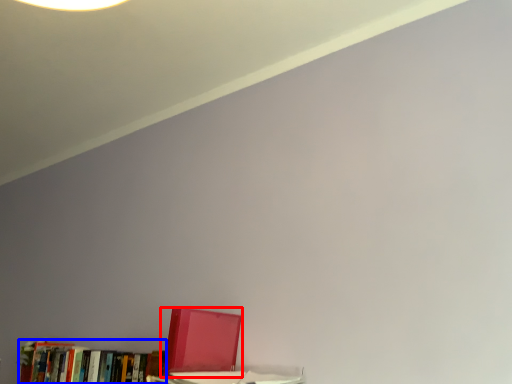
Question: Which object is closer to the camera taking this photo, book (highlighted by a red box) or book (highlighted by a blue box)?

Choices:
 (A) book
 (B) book

Answer: (A)